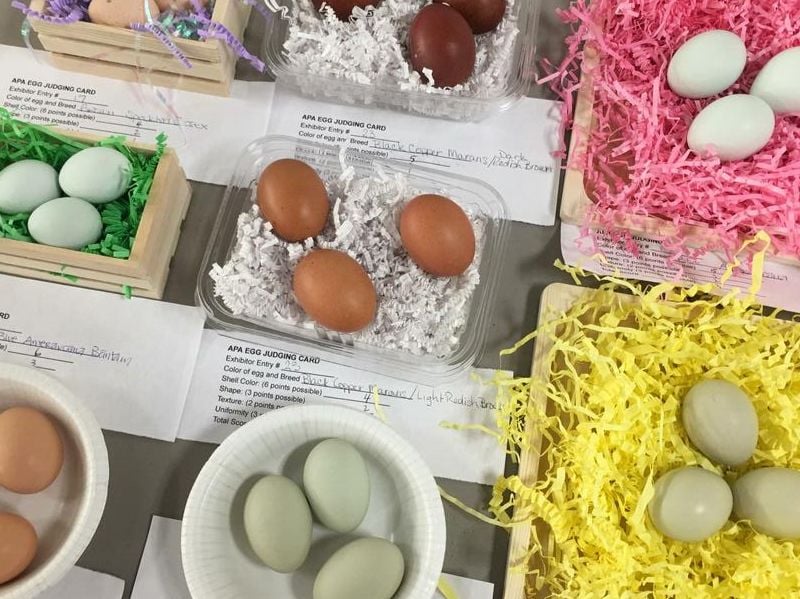
The width and height of the screenshot is (800, 599). Identify the location of three eggs in bowl. (454, 244), (342, 310), (300, 213).